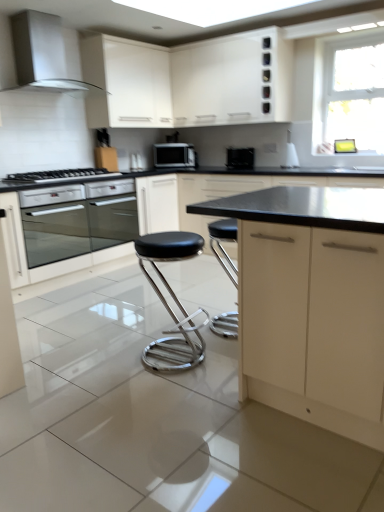
Question: Considering the relative sizes of black glossy toaster at center and satin silver oven at lower left in the image provided, is black glossy toaster at center thinner than satin silver oven at lower left?

Choices:
 (A) no
 (B) yes

Answer: (B)

Question: Is black glossy toaster at center to the right of satin silver oven at lower left from the viewer's perspective?

Choices:
 (A) no
 (B) yes

Answer: (B)

Question: Is black glossy toaster at center at the left side of satin silver oven at lower left?

Choices:
 (A) no
 (B) yes

Answer: (A)

Question: Considering the relative sizes of black glossy toaster at center and satin silver oven at lower left in the image provided, is black glossy toaster at center smaller than satin silver oven at lower left?

Choices:
 (A) no
 (B) yes

Answer: (B)

Question: Is black glossy toaster at center further to camera compared to satin silver oven at lower left?

Choices:
 (A) yes
 (B) no

Answer: (A)

Question: In terms of height, does matte cream cabinet at center, acting as the fourth cabinetry starting from the top, look taller or shorter compared to satin silver range hood at upper left?

Choices:
 (A) tall
 (B) short

Answer: (A)

Question: Considering the relative positions of matte cream cabinet at center, the 1th cabinetry positioned from the bottom, and satin silver range hood at upper left in the image provided, is matte cream cabinet at center, the 1th cabinetry positioned from the bottom, to the left or to the right of satin silver range hood at upper left?

Choices:
 (A) right
 (B) left

Answer: (A)

Question: In the image, is matte cream cabinet at center, the 1th cabinetry positioned from the bottom, positioned in front of or behind satin silver range hood at upper left?

Choices:
 (A) behind
 (B) front

Answer: (B)

Question: From the image's perspective, is matte cream cabinet at center, acting as the fourth cabinetry starting from the top, located above or below satin silver range hood at upper left?

Choices:
 (A) below
 (B) above

Answer: (A)

Question: From a real-world perspective, is white matte cabinet at upper center, which appears as the 1th cabinetry when viewed from the top, physically located above or below white matte cabinet at upper center, the 3th cabinetry positioned from the bottom?

Choices:
 (A) above
 (B) below

Answer: (A)

Question: Is point (281, 69) positioned closer to the camera than point (112, 83)?

Choices:
 (A) closer
 (B) farther

Answer: (A)

Question: From the image's perspective, is white matte cabinet at upper center, arranged as the fourth cabinetry when ordered from the bottom, located above or below white matte cabinet at upper center, which ranks as the second cabinetry in top-to-bottom order?

Choices:
 (A) below
 (B) above

Answer: (B)

Question: Considering the positions of white matte cabinet at upper center, which appears as the 1th cabinetry when viewed from the top, and white matte cabinet at upper center, the 3th cabinetry positioned from the bottom, in the image, is white matte cabinet at upper center, which appears as the 1th cabinetry when viewed from the top, wider or thinner than white matte cabinet at upper center, the 3th cabinetry positioned from the bottom,?

Choices:
 (A) thin
 (B) wide

Answer: (B)

Question: From a real-world perspective, relative to black matte cabinet at center, marked as the 3th cabinetry in a top-to-bottom arrangement, is satin silver range hood at upper left vertically above or below?

Choices:
 (A) below
 (B) above

Answer: (B)

Question: Is satin silver range hood at upper left taller or shorter than black matte cabinet at center, marked as the 3th cabinetry in a top-to-bottom arrangement?

Choices:
 (A) short
 (B) tall

Answer: (A)